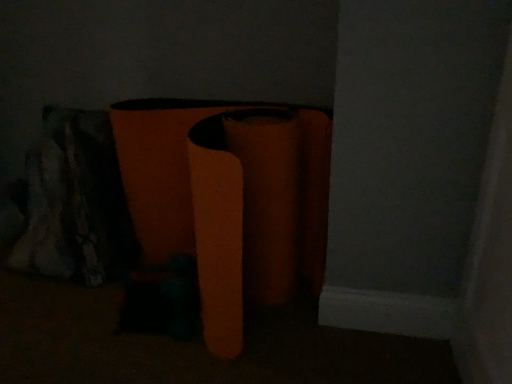
In order to face orange felt stool at center, should I rotate leftwards or rightwards?

To face it directly, rotate left by 7.099 degrees.

Where is `orange felt stool at center`? This screenshot has width=512, height=384. orange felt stool at center is located at coordinates (212, 197).

What do you see at coordinates (212, 197) in the screenshot? The image size is (512, 384). I see `orange felt stool at center` at bounding box center [212, 197].

Identify the location of orange felt stool at center. The image size is (512, 384). (212, 197).